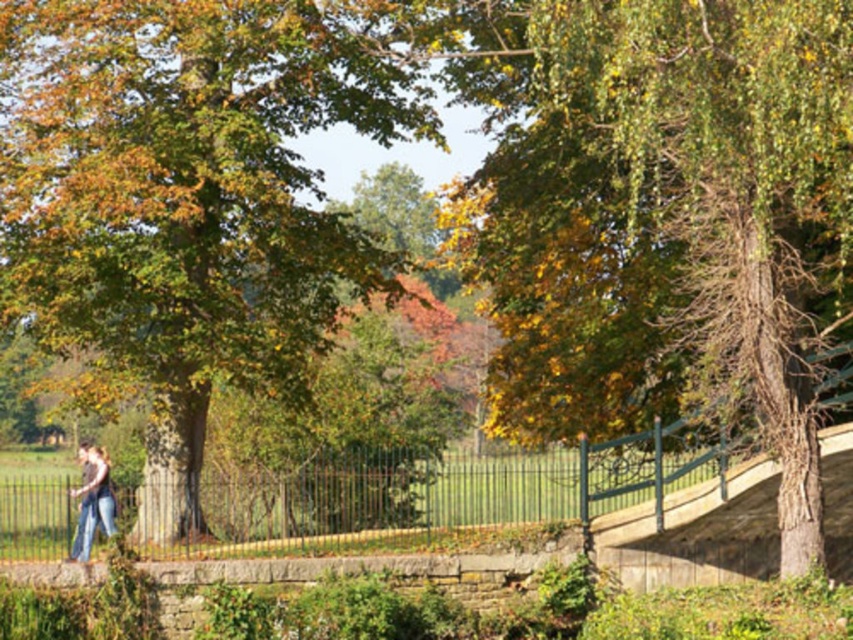
Between green leafy tree at upper right and green leafy tree at left, which one has less height?

With less height is green leafy tree at upper right.

The width and height of the screenshot is (853, 640). Find the location of `green leafy tree at upper right`. green leafy tree at upper right is located at coordinates (671, 209).